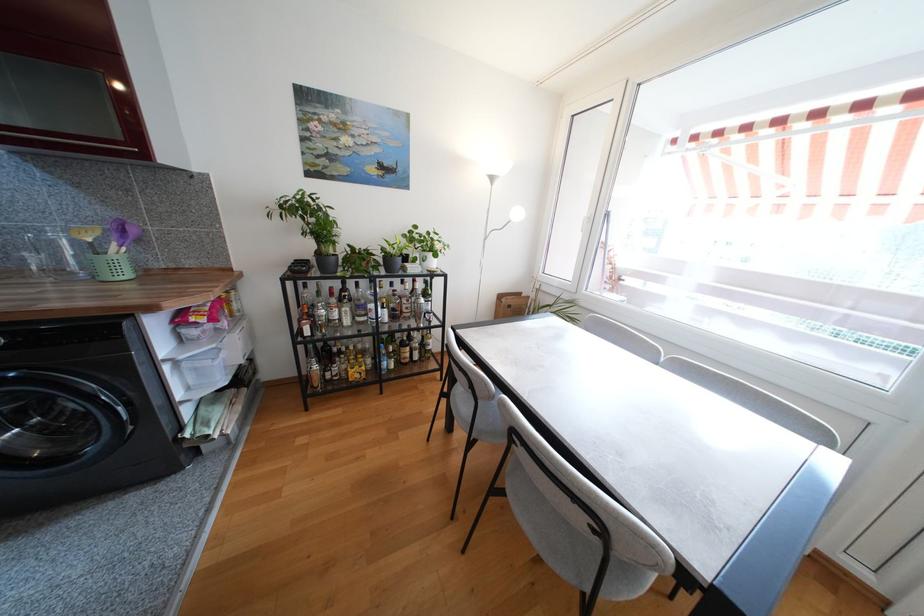
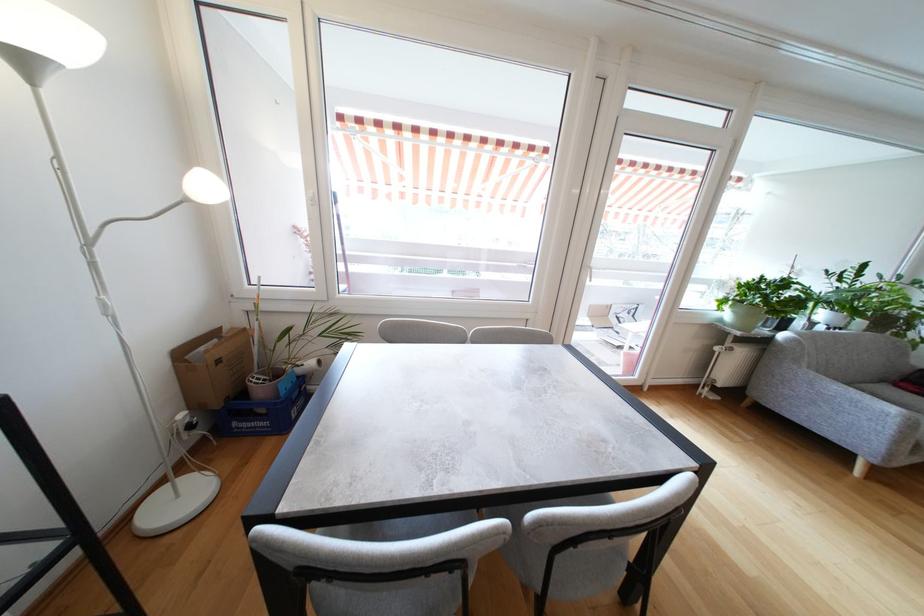
Find the pixel in the second image that matches the point at 505,304 in the first image.

(191, 363)